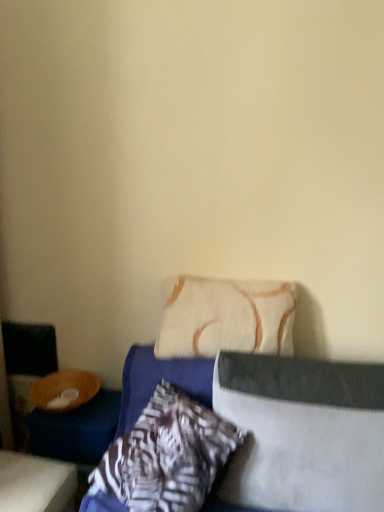
This screenshot has width=384, height=512. Describe the element at coordinates (166, 456) in the screenshot. I see `patterned fabric pillow at center, the third pillow positioned from the right` at that location.

Identify the location of beige textured pillow at center, the 2th pillow from the left. The image size is (384, 512). (225, 317).

Where is `textured beige pillow at center, which ranks as the 3th pillow in left-to-right order`? textured beige pillow at center, which ranks as the 3th pillow in left-to-right order is located at coordinates (303, 432).

Could you measure the distance between beige textured pillow at center, the 2th pillow from the left, and textured blue bed at center?

The distance of beige textured pillow at center, the 2th pillow from the left, from textured blue bed at center is 6.35 inches.

Which is in front, point (254, 319) or point (368, 463)?

Positioned in front is point (368, 463).

Is beige textured pillow at center, which is counted as the 2th pillow, starting from the right, thinner than textured blue bed at center?

Yes.

Which of these two, beige textured pillow at center, which is counted as the 2th pillow, starting from the right, or textured blue bed at center, stands shorter?

beige textured pillow at center, which is counted as the 2th pillow, starting from the right.

Which is correct: textured blue bed at center is inside beige textured pillow at center, the 2th pillow from the left, or outside of it?

textured blue bed at center is not enclosed by beige textured pillow at center, the 2th pillow from the left.

From a real-world perspective, who is located higher, textured blue bed at center or beige textured pillow at center, which is counted as the 2th pillow, starting from the right?

From a 3D spatial view, beige textured pillow at center, which is counted as the 2th pillow, starting from the right, is above.

This screenshot has height=512, width=384. What are the coordinates of `bed in front of the beige textured pillow at center, which is counted as the 2th pillow, starting from the right` in the screenshot? It's located at (261, 430).

In the image, there is a patterned fabric pillow at center, the third pillow positioned from the right. Find the location of `furniture below it (from the image's perspective)`. furniture below it (from the image's perspective) is located at coordinates (35, 483).

How many degrees apart are the facing directions of patterned fabric pillow at center, which is counted as the first pillow, starting from the left, and wooden table at lower left?

The angular difference between patterned fabric pillow at center, which is counted as the first pillow, starting from the left, and wooden table at lower left is 34.7 degrees.

From the image's perspective, which one is positioned higher, patterned fabric pillow at center, the third pillow positioned from the right, or wooden table at lower left?

patterned fabric pillow at center, the third pillow positioned from the right, appears higher in the image.

Is patterned fabric pillow at center, which is counted as the first pillow, starting from the left, facing towards wooden table at lower left?

No, patterned fabric pillow at center, which is counted as the first pillow, starting from the left, is not oriented towards wooden table at lower left.

Considering the sizes of textured beige pillow at center, which ranks as the 3th pillow in left-to-right order, and wooden table at lower left in the image, is textured beige pillow at center, which ranks as the 3th pillow in left-to-right order, wider or thinner than wooden table at lower left?

Considering their sizes, textured beige pillow at center, which ranks as the 3th pillow in left-to-right order, looks broader than wooden table at lower left.

From the wooden table at lower left, count 3rd pillow to the right and point to it. Please provide its 2D coordinates.

[(303, 432)]

In terms of size, does textured beige pillow at center, the first pillow in the right-to-left sequence, appear bigger or smaller than wooden table at lower left?

Clearly, textured beige pillow at center, the first pillow in the right-to-left sequence, is larger in size than wooden table at lower left.

Which is more to the right, textured beige pillow at center, the first pillow in the right-to-left sequence, or wooden table at lower left?

From the viewer's perspective, textured beige pillow at center, the first pillow in the right-to-left sequence, appears more on the right side.

Does beige textured pillow at center, which is counted as the 2th pillow, starting from the right, touch textured beige pillow at center, the first pillow in the right-to-left sequence?

No, beige textured pillow at center, which is counted as the 2th pillow, starting from the right, is not beside textured beige pillow at center, the first pillow in the right-to-left sequence.

Does point (173, 305) appear closer or farther from the camera than point (254, 419)?

Point (173, 305) is farther from the camera than point (254, 419).

Between beige textured pillow at center, the 2th pillow from the left, and textured beige pillow at center, which ranks as the 3th pillow in left-to-right order, which one has less height?

beige textured pillow at center, the 2th pillow from the left.

Choose the correct answer: Is beige textured pillow at center, which is counted as the 2th pillow, starting from the right, inside textured beige pillow at center, the first pillow in the right-to-left sequence, or outside it?

beige textured pillow at center, which is counted as the 2th pillow, starting from the right, is located beyond the bounds of textured beige pillow at center, the first pillow in the right-to-left sequence.

This screenshot has width=384, height=512. In order to click on furniture that appears in front of the beige textured pillow at center, which is counted as the 2th pillow, starting from the right in this screenshot , I will do `click(35, 483)`.

Is beige textured pillow at center, the 2th pillow from the left, wider than wooden table at lower left?

No, beige textured pillow at center, the 2th pillow from the left, is not wider than wooden table at lower left.

Is the surface of beige textured pillow at center, the 2th pillow from the left, in direct contact with wooden table at lower left?

beige textured pillow at center, the 2th pillow from the left, and wooden table at lower left are not in contact.

Considering the relative sizes of beige textured pillow at center, which is counted as the 2th pillow, starting from the right, and wooden table at lower left in the image provided, is beige textured pillow at center, which is counted as the 2th pillow, starting from the right, smaller than wooden table at lower left?

No.

Does point (223, 301) come in front of point (61, 474)?

No, (223, 301) is behind (61, 474).

Locate an element on the screen. furniture below the textured blue bed at center (from a real-world perspective) is located at coordinates (35, 483).

From a real-world perspective, is textured blue bed at center located higher than wooden table at lower left?

Indeed, from a real-world perspective, textured blue bed at center stands above wooden table at lower left.

Find the location of a particular element. The image size is (384, 512). bed that appears below the beige textured pillow at center, the 2th pillow from the left (from a real-world perspective) is located at coordinates (261, 430).

Identify the location of bed on the right of beige textured pillow at center, which is counted as the 2th pillow, starting from the right. Image resolution: width=384 pixels, height=512 pixels. (261, 430).

Which object lies nearer to the anchor point beige textured pillow at center, the 2th pillow from the left, wooden table at lower left or textured blue bed at center?

textured blue bed at center is positioned closer to the anchor beige textured pillow at center, the 2th pillow from the left.

When comparing their distances from textured blue bed at center, does beige textured pillow at center, which is counted as the 2th pillow, starting from the right, or textured beige pillow at center, which ranks as the 3th pillow in left-to-right order, seem further?

The object further to textured blue bed at center is beige textured pillow at center, which is counted as the 2th pillow, starting from the right.

From the image, which object appears to be farther from textured blue bed at center, wooden table at lower left or beige textured pillow at center, which is counted as the 2th pillow, starting from the right?

The object further to textured blue bed at center is wooden table at lower left.

From the image, which object appears to be nearer to textured beige pillow at center, the first pillow in the right-to-left sequence, textured blue bed at center or patterned fabric pillow at center, the third pillow positioned from the right?

textured blue bed at center.

From the image, which object appears to be nearer to patterned fabric pillow at center, which is counted as the first pillow, starting from the left, textured beige pillow at center, the first pillow in the right-to-left sequence, or wooden table at lower left?

Based on the image, textured beige pillow at center, the first pillow in the right-to-left sequence, appears to be nearer to patterned fabric pillow at center, which is counted as the first pillow, starting from the left.

When comparing their distances from patterned fabric pillow at center, the third pillow positioned from the right, does textured beige pillow at center, which ranks as the 3th pillow in left-to-right order, or beige textured pillow at center, the 2th pillow from the left, seem further?

beige textured pillow at center, the 2th pillow from the left, is positioned further to the anchor patterned fabric pillow at center, the third pillow positioned from the right.

Based on their spatial positions, is beige textured pillow at center, which is counted as the 2th pillow, starting from the right, or patterned fabric pillow at center, which is counted as the first pillow, starting from the left, further from wooden table at lower left?

The object further to wooden table at lower left is beige textured pillow at center, which is counted as the 2th pillow, starting from the right.

Which object lies nearer to the anchor point textured blue bed at center, wooden table at lower left or patterned fabric pillow at center, the third pillow positioned from the right?

patterned fabric pillow at center, the third pillow positioned from the right, is positioned closer to the anchor textured blue bed at center.

The height and width of the screenshot is (512, 384). What are the coordinates of `furniture between textured blue bed at center and beige textured pillow at center, which is counted as the 2th pillow, starting from the right, in the front-back direction` in the screenshot? It's located at (35, 483).

Find the location of `pillow located between wooden table at lower left and beige textured pillow at center, the 2th pillow from the left, in the left-right direction`. pillow located between wooden table at lower left and beige textured pillow at center, the 2th pillow from the left, in the left-right direction is located at coordinates [x=166, y=456].

The height and width of the screenshot is (512, 384). What are the coordinates of `bed located between wooden table at lower left and textured beige pillow at center, which ranks as the 3th pillow in left-to-right order, in the left-right direction` in the screenshot? It's located at (261, 430).

Find the location of a particular element. pillow between patterned fabric pillow at center, which is counted as the first pillow, starting from the left, and beige textured pillow at center, which is counted as the 2th pillow, starting from the right, from front to back is located at coordinates (303, 432).